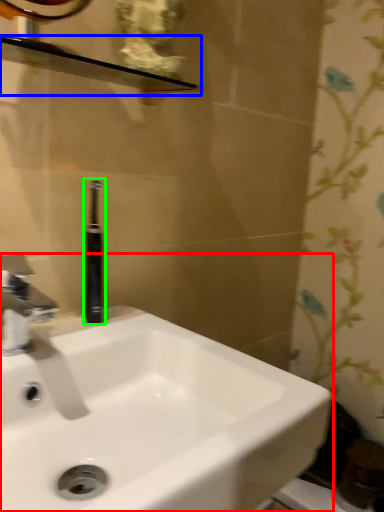
Question: Based on their relative distances, which object is nearer to sink (highlighted by a red box)? Choose from balustrade (highlighted by a blue box) and toiletry (highlighted by a green box).

Choices:
 (A) balustrade
 (B) toiletry

Answer: (B)